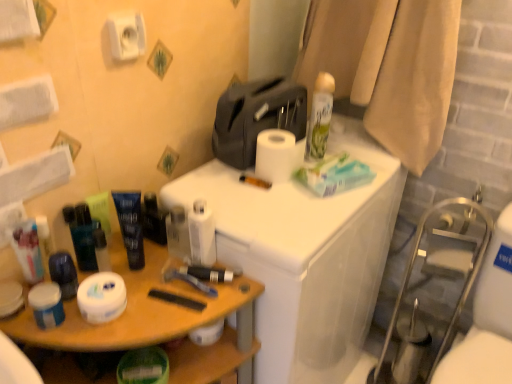
Find the location of `free space in front of translucent plastic can at upper right`. free space in front of translucent plastic can at upper right is located at coordinates (306, 208).